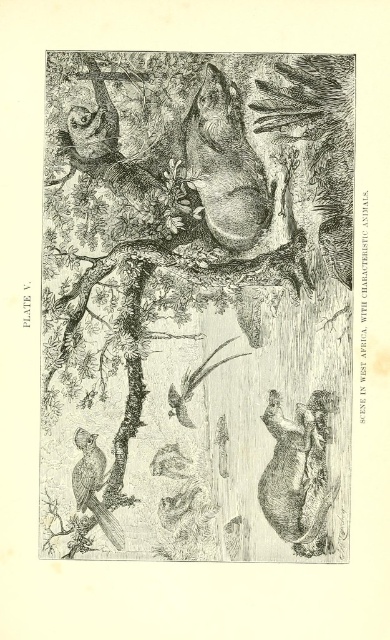
Question: Is black ink drawing of tree at center thinner than brown fur bear at center?

Choices:
 (A) no
 (B) yes

Answer: (A)

Question: Does black ink drawing of tree at center have a greater width compared to brown fur bear at center?

Choices:
 (A) no
 (B) yes

Answer: (B)

Question: Which of these objects is positioned farthest from the brown textured bird at lower left?

Choices:
 (A) brown fur bear at center
 (B) black ink drawing of tree at center

Answer: (B)

Question: Is black ink drawing of tree at center bigger than brown fur bear at center?

Choices:
 (A) no
 (B) yes

Answer: (B)

Question: Which point is farther from the camera taking this photo?

Choices:
 (A) (262, 484)
 (B) (152, 136)
 (C) (78, 484)

Answer: (B)

Question: Which object appears closest to the camera in this image?

Choices:
 (A) brown fur bear at center
 (B) black ink drawing of tree at center

Answer: (A)